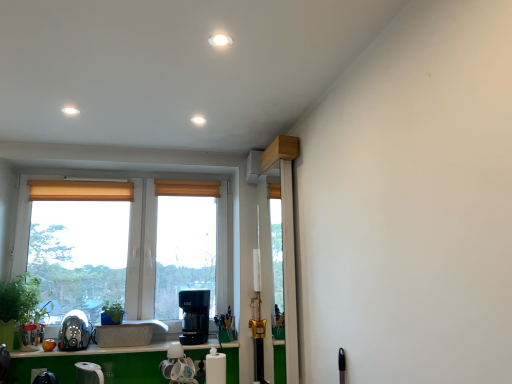
Question: Is satin silver coffee machine at lower left, positioned as the first coffee machine in left-to-right order, further to camera compared to clear plastic screen door at center?

Choices:
 (A) no
 (B) yes

Answer: (B)

Question: Is satin silver coffee machine at lower left, positioned as the first coffee machine in left-to-right order, aimed at clear plastic screen door at center?

Choices:
 (A) yes
 (B) no

Answer: (B)

Question: From a real-world perspective, is satin silver coffee machine at lower left, which appears as the second coffee machine when viewed from the right, over clear plastic screen door at center?

Choices:
 (A) yes
 (B) no

Answer: (B)

Question: Can we say satin silver coffee machine at lower left, positioned as the first coffee machine in left-to-right order, lies outside clear plastic screen door at center?

Choices:
 (A) no
 (B) yes

Answer: (B)

Question: From the image's perspective, is satin silver coffee machine at lower left, positioned as the first coffee machine in left-to-right order, below clear plastic screen door at center?

Choices:
 (A) no
 (B) yes

Answer: (B)

Question: From the image's perspective, is satin silver coffee machine at lower left, positioned as the first coffee machine in left-to-right order, over clear plastic screen door at center?

Choices:
 (A) yes
 (B) no

Answer: (B)

Question: From the image's perspective, is black plastic coffee machine at lower center, which is counted as the 1th coffee machine, starting from the right, under green matte plant at center, which ranks as the first plant in right-to-left order?

Choices:
 (A) no
 (B) yes

Answer: (B)

Question: Is black plastic coffee machine at lower center, positioned as the second coffee machine in left-to-right order, positioned before green matte plant at center, which ranks as the first plant in right-to-left order?

Choices:
 (A) yes
 (B) no

Answer: (B)

Question: Can you confirm if black plastic coffee machine at lower center, positioned as the second coffee machine in left-to-right order, is smaller than green matte plant at center, positioned as the second plant in left-to-right order?

Choices:
 (A) yes
 (B) no

Answer: (B)

Question: Considering the relative sizes of black plastic coffee machine at lower center, which is counted as the 1th coffee machine, starting from the right, and green matte plant at center, which ranks as the first plant in right-to-left order, in the image provided, is black plastic coffee machine at lower center, which is counted as the 1th coffee machine, starting from the right, taller than green matte plant at center, which ranks as the first plant in right-to-left order,?

Choices:
 (A) yes
 (B) no

Answer: (A)

Question: Can you confirm if black plastic coffee machine at lower center, which is counted as the 1th coffee machine, starting from the right, is positioned to the right of green matte plant at center, positioned as the second plant in left-to-right order?

Choices:
 (A) no
 (B) yes

Answer: (B)

Question: Considering the relative sizes of black plastic coffee machine at lower center, positioned as the second coffee machine in left-to-right order, and green matte plant at center, which ranks as the first plant in right-to-left order, in the image provided, is black plastic coffee machine at lower center, positioned as the second coffee machine in left-to-right order, wider than green matte plant at center, which ranks as the first plant in right-to-left order,?

Choices:
 (A) no
 (B) yes

Answer: (B)

Question: Could white matte sink at lower center be considered to be inside green matte plant at left, the second plant viewed from the right?

Choices:
 (A) no
 (B) yes

Answer: (A)